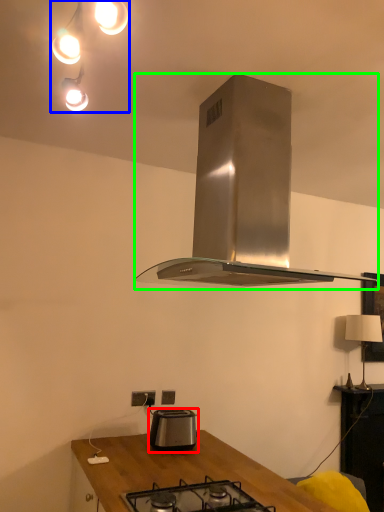
Question: Considering the real-world distances, which object is farthest from toaster (highlighted by a red box)? light fixture (highlighted by a blue box) or kitchen appliance (highlighted by a green box)?

Choices:
 (A) light fixture
 (B) kitchen appliance

Answer: (A)